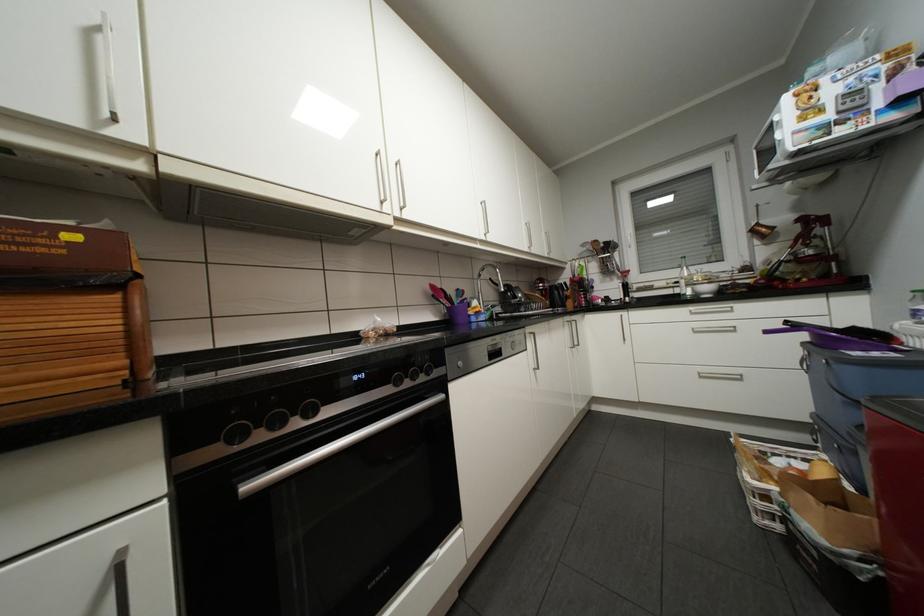
Find the location of a particular element. red juicer handle is located at coordinates (823, 220).